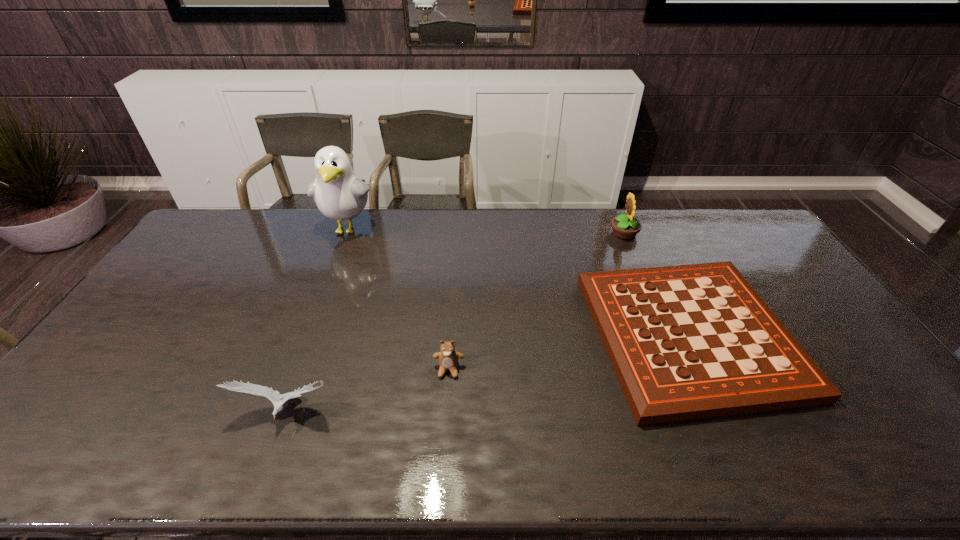
Identify the location of the taller gull. Image resolution: width=960 pixels, height=540 pixels. (339, 194).

This screenshot has width=960, height=540. Identify the location of the tallest object. (339, 194).

This screenshot has height=540, width=960. In order to click on the second tallest object in this screenshot , I will do `click(626, 227)`.

Find the location of a particular element. The image size is (960, 540). the third tallest object is located at coordinates 274,396.

The height and width of the screenshot is (540, 960). I want to click on the shorter gull, so click(274, 396).

You are a GUI agent. You are given a task and a screenshot of the screen. Output one action in this format:
    pyautogui.click(x=<x>, y=<y>)
    Task: Click on the second shortest object
    
    Given the screenshot: What is the action you would take?
    pyautogui.click(x=448, y=358)

The height and width of the screenshot is (540, 960). In order to click on teddy bear in this screenshot , I will do `click(448, 358)`.

At what (x,y) coordinates should I click in order to perform the action: click on the shortest object. Please return your answer as a coordinate pair (x, y). This screenshot has width=960, height=540. Looking at the image, I should click on [x=693, y=341].

The width and height of the screenshot is (960, 540). In order to click on vacant area situated on the beak of the farther gull in this screenshot , I will do `click(337, 259)`.

Where is `free space located on the face of the sunflower`? free space located on the face of the sunflower is located at coordinates (588, 233).